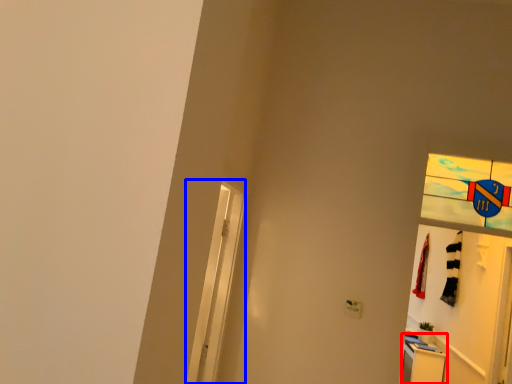
Question: Which point is further to the camera, dresser (highlighted by a red box) or screen door (highlighted by a blue box)?

Choices:
 (A) dresser
 (B) screen door

Answer: (A)